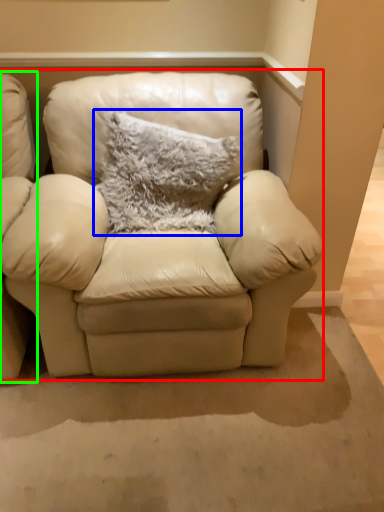
Question: Based on their relative distances, which object is farther from studio couch (highlighted by a red box)? Choose from pillow (highlighted by a blue box) and chair (highlighted by a green box).

Choices:
 (A) pillow
 (B) chair

Answer: (B)